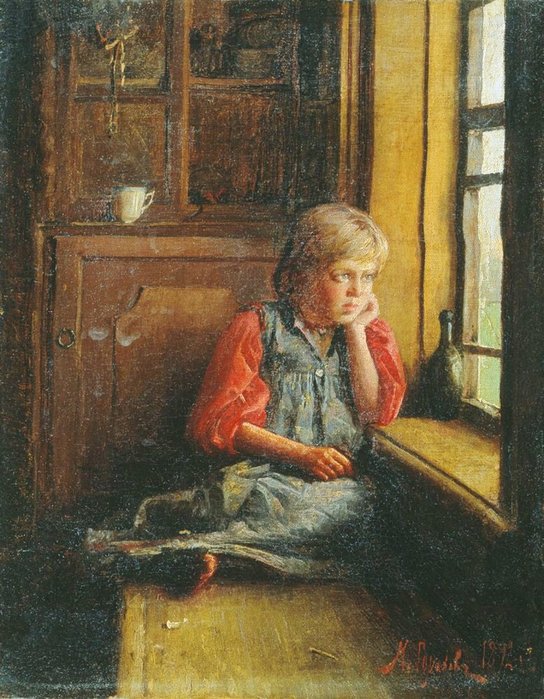
The image size is (544, 699). Identify the location of wine bottle. (457, 375).